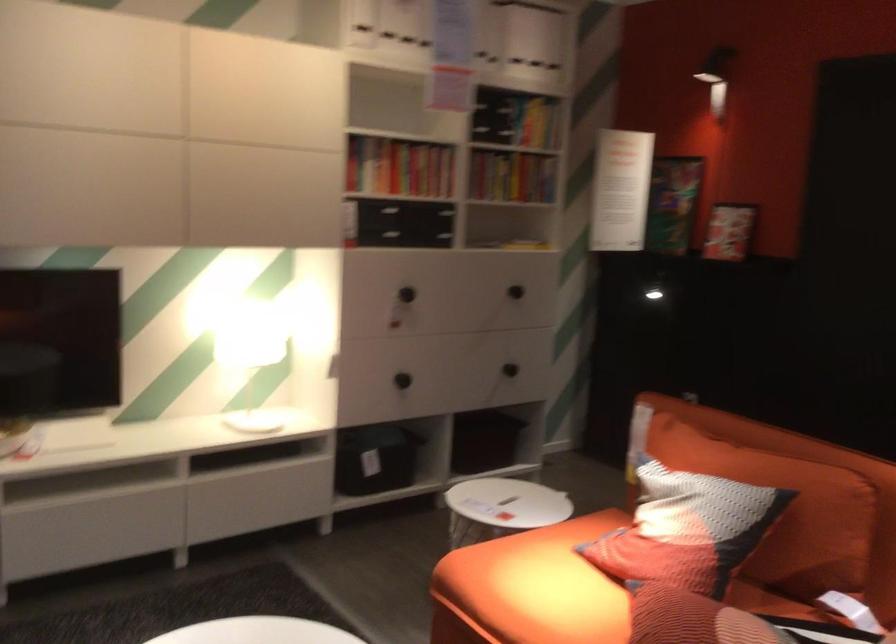
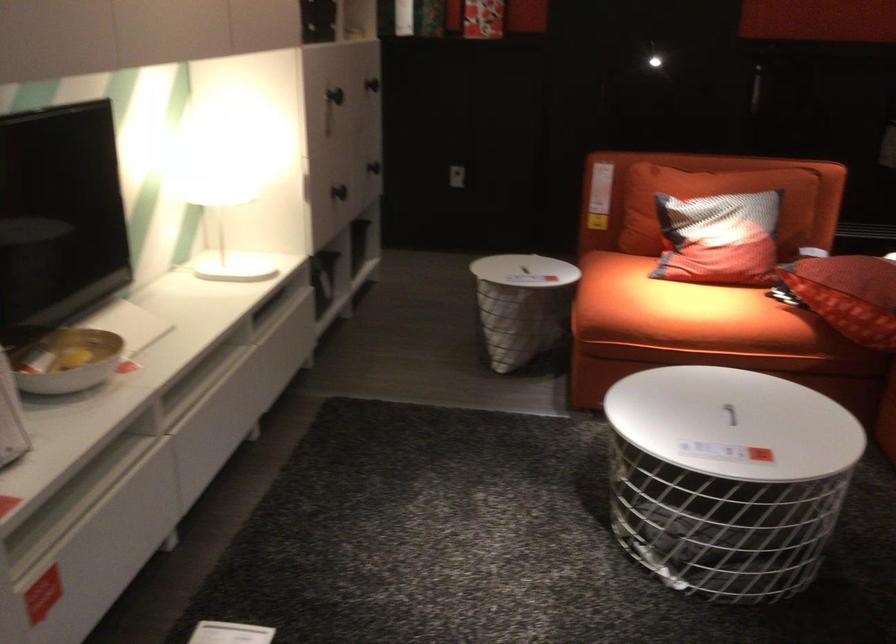
Locate, in the second image, the point that corresponds to pixel 410 287 in the first image.

(334, 95)